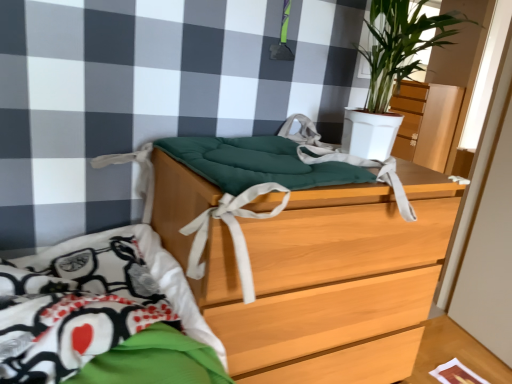
Question: Can you confirm if wooden chest of drawers at center is positioned to the left of matte wood dresser at upper right?

Choices:
 (A) no
 (B) yes

Answer: (B)

Question: Does wooden chest of drawers at center lie behind matte wood dresser at upper right?

Choices:
 (A) yes
 (B) no

Answer: (B)

Question: Does wooden chest of drawers at center have a lesser height compared to matte wood dresser at upper right?

Choices:
 (A) yes
 (B) no

Answer: (B)

Question: Does wooden chest of drawers at center appear on the right side of matte wood dresser at upper right?

Choices:
 (A) no
 (B) yes

Answer: (A)

Question: From the image's perspective, would you say wooden chest of drawers at center is positioned over matte wood dresser at upper right?

Choices:
 (A) yes
 (B) no

Answer: (B)

Question: Considering the relative sizes of wooden chest of drawers at center and matte wood dresser at upper right in the image provided, is wooden chest of drawers at center taller than matte wood dresser at upper right?

Choices:
 (A) no
 (B) yes

Answer: (B)

Question: Considering the relative sizes of matte wood dresser at upper right and green matte plant at upper right in the image provided, is matte wood dresser at upper right smaller than green matte plant at upper right?

Choices:
 (A) yes
 (B) no

Answer: (B)

Question: Is matte wood dresser at upper right facing towards green matte plant at upper right?

Choices:
 (A) no
 (B) yes

Answer: (A)

Question: Is matte wood dresser at upper right outside of green matte plant at upper right?

Choices:
 (A) no
 (B) yes

Answer: (B)

Question: Does matte wood dresser at upper right have a larger size compared to green matte plant at upper right?

Choices:
 (A) no
 (B) yes

Answer: (B)

Question: Does matte wood dresser at upper right have a lesser width compared to green matte plant at upper right?

Choices:
 (A) no
 (B) yes

Answer: (A)

Question: Is matte wood dresser at upper right at the left side of green matte plant at upper right?

Choices:
 (A) no
 (B) yes

Answer: (A)

Question: From a real-world perspective, is green matte plant at upper right located beneath wooden chest of drawers at center?

Choices:
 (A) no
 (B) yes

Answer: (A)